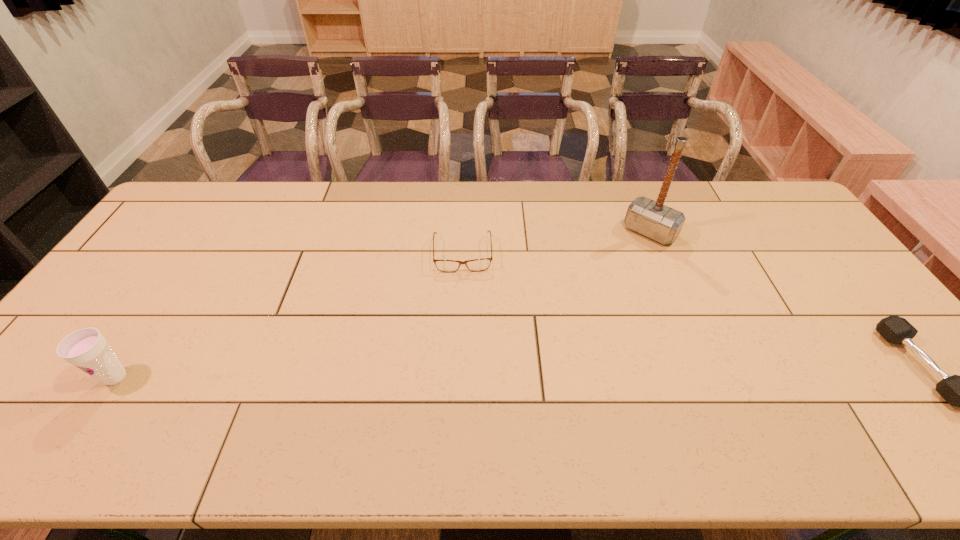
Locate an element on the screen. The height and width of the screenshot is (540, 960). free spot located on the lenses of the second object from left to right is located at coordinates (465, 344).

This screenshot has height=540, width=960. Find the location of `free point located on the lenses of the second object from left to right`. free point located on the lenses of the second object from left to right is located at coordinates (464, 290).

At what (x,y) coordinates should I click in order to perform the action: click on vacant space located 0.220m on the lenses of the second object from left to right. Please return your answer as a coordinate pair (x, y). Looking at the image, I should click on (465, 332).

What are the coordinates of `object that is at the far edge` in the screenshot? It's located at (659, 222).

The width and height of the screenshot is (960, 540). Identify the location of object situated at the near edge. (87, 349).

Where is `object at the left edge`? This screenshot has width=960, height=540. object at the left edge is located at coordinates (87, 349).

What are the coordinates of `object present at the near left corner` in the screenshot? It's located at (87, 349).

Image resolution: width=960 pixels, height=540 pixels. Identify the location of free space at the far edge of the desktop. (303, 201).

Where is `vacant area at the near edge of the desktop`? vacant area at the near edge of the desktop is located at coordinates (253, 395).

The height and width of the screenshot is (540, 960). In order to click on free space at the left edge of the desktop in this screenshot , I will do `click(180, 247)`.